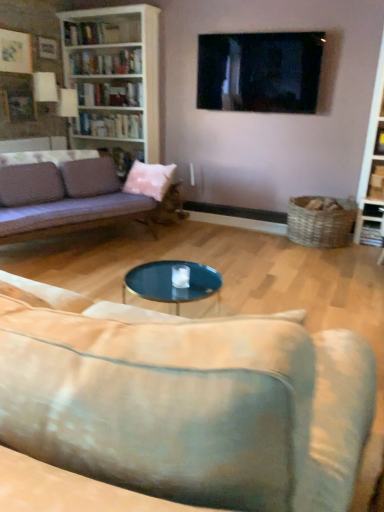
What do you see at coordinates (186, 400) in the screenshot?
I see `velvet beige couch at lower center, the 1th studio couch viewed from the front` at bounding box center [186, 400].

Locate an element on the screen. white glossy bookshelf at upper left, the 2th book positioned from the bottom is located at coordinates (106, 62).

I want to click on white glossy bookshelf at upper left, so click(x=102, y=31).

Describe the element at coordinates (111, 125) in the screenshot. The width and height of the screenshot is (384, 512). I see `hardcover books at upper left, the first book from the bottom` at that location.

The width and height of the screenshot is (384, 512). What are the coordinates of `white wood bookcase at upper left` in the screenshot? It's located at (114, 76).

Are white wood bookcase at upper left and white glossy bookshelf at upper left located far from each other?

They are positioned close to each other.

From the image's perspective, who appears lower, white wood bookcase at upper left or white glossy bookshelf at upper left?

white wood bookcase at upper left appears lower in the image.

Considering the relative sizes of white wood bookcase at upper left and white glossy bookshelf at upper left in the image provided, is white wood bookcase at upper left taller than white glossy bookshelf at upper left?

Indeed, white wood bookcase at upper left has a greater height compared to white glossy bookshelf at upper left.

Which object is wider, white wood bookcase at upper left or white glossy bookshelf at upper left?

Wider between the two is white wood bookcase at upper left.

Between white glossy bookshelf at upper left and hardcover books at upper left, the second book from the top, which one has smaller size?

With smaller size is white glossy bookshelf at upper left.

You are a GUI agent. You are given a task and a screenshot of the screen. Output one action in this format:
    pyautogui.click(x=<x>, y=<y>)
    Task: Click on the 2nd book counting from the left of the white glossy bookshelf at upper left
    The width and height of the screenshot is (384, 512).
    Given the screenshot: What is the action you would take?
    pyautogui.click(x=111, y=125)

From the image's perspective, would you say white glossy bookshelf at upper left is shown under hardcover books at upper left, the second book from the top?

No.

Which is closer to the camera, (108, 120) or (117, 71)?

Point (108, 120) is positioned farther from the camera compared to point (117, 71).

Which of these two, hardcover books at upper left, the second book from the top, or white glossy bookshelf at upper left, which is the first book in top-to-bottom order, is bigger?

hardcover books at upper left, the second book from the top, is bigger.

The height and width of the screenshot is (512, 384). I want to click on book beneath the white glossy bookshelf at upper left, the 2th book positioned from the bottom (from a real-world perspective), so [x=111, y=125].

Is the position of black glossy tv at upper center less distant than that of white wood bookcase at upper left?

Yes, it is in front of white wood bookcase at upper left.

Does black glossy tv at upper center have a lesser width compared to white wood bookcase at upper left?

Result: Yes.

Who is smaller, black glossy tv at upper center or white wood bookcase at upper left?

With smaller size is black glossy tv at upper center.

In the scene shown: Is black glossy tv at upper center aimed at white wood bookcase at upper left?

No.

How much distance is there between black glossy tv at upper center and pink fabric pillow at center?

black glossy tv at upper center and pink fabric pillow at center are 1.21 meters apart from each other.

Can you confirm if black glossy tv at upper center is positioned to the right of pink fabric pillow at center?

Indeed, black glossy tv at upper center is positioned on the right side of pink fabric pillow at center.

Is black glossy tv at upper center oriented towards pink fabric pillow at center?

No, black glossy tv at upper center does not turn towards pink fabric pillow at center.

Looking at this image, would you say pink fabric pillow at center is part of black glossy tv at upper center's contents?

Definitely not — pink fabric pillow at center is not inside black glossy tv at upper center.

How much distance is there between pink fabric pillow at center and velvet beige couch at lower center, acting as the 2th studio couch starting from the back?

They are 2.96 meters apart.

From the image's perspective, is pink fabric pillow at center below velvet beige couch at lower center, the 1th studio couch viewed from the front?

No.

Is pink fabric pillow at center directly adjacent to velvet beige couch at lower center, acting as the 2th studio couch starting from the back?

pink fabric pillow at center and velvet beige couch at lower center, acting as the 2th studio couch starting from the back, are not in contact.

Is pink fabric pillow at center thinner than velvet beige couch at lower center, acting as the 2th studio couch starting from the back?

Yes.

From the image's perspective, is pink fabric pillow at center located above or below velvet purple couch at left, the first studio couch viewed from the back?

From the image's perspective, pink fabric pillow at center appears above velvet purple couch at left, the first studio couch viewed from the back.

From a real-world perspective, is pink fabric pillow at center beneath velvet purple couch at left, the second studio couch positioned from the front?

No, from a real-world perspective, pink fabric pillow at center is not below velvet purple couch at left, the second studio couch positioned from the front.

Can you confirm if pink fabric pillow at center is positioned to the left of velvet purple couch at left, the second studio couch positioned from the front?

No.

Find the location of a particular element. bookcase that is below the white glossy bookshelf at upper left (from the image's perspective) is located at coordinates (114, 76).

Find the location of a particular element. The width and height of the screenshot is (384, 512). the 2nd book to the left when counting from the white glossy bookshelf at upper left is located at coordinates (111, 125).

Which object lies further to the anchor point white glossy bookshelf at upper left, white glossy bookshelf at upper left, the 2th book positioned from the bottom, or black glossy tv at upper center?

black glossy tv at upper center.

Which object lies nearer to the anchor point white glossy bookshelf at upper left, velvet beige couch at lower center, the 1th studio couch viewed from the front, or black glossy tv at upper center?

black glossy tv at upper center.

Considering their positions, is pink fabric pillow at center positioned closer to hardcover books at upper left, the first book from the bottom, than white glossy bookshelf at upper left?

white glossy bookshelf at upper left.

Considering their positions, is white glossy bookshelf at upper left, the 2th book positioned from the bottom, positioned further to white wood bookcase at upper left than velvet beige couch at lower center, acting as the 2th studio couch starting from the back?

velvet beige couch at lower center, acting as the 2th studio couch starting from the back, is further to white wood bookcase at upper left.

Based on the photo, based on their spatial positions, is pink fabric pillow at center or hardcover books at upper left, the first book from the bottom, closer to white glossy bookshelf at upper left?

hardcover books at upper left, the first book from the bottom, is positioned closer to the anchor white glossy bookshelf at upper left.

Based on their spatial positions, is pink fabric pillow at center or velvet beige couch at lower center, the 1th studio couch viewed from the front, further from white glossy bookshelf at upper left?

Among the two, velvet beige couch at lower center, the 1th studio couch viewed from the front, is located further to white glossy bookshelf at upper left.

Estimate the real-world distances between objects in this image. Which object is further from white glossy bookshelf at upper left, white wood bookcase at upper left or velvet beige couch at lower center, the 1th studio couch viewed from the front?

velvet beige couch at lower center, the 1th studio couch viewed from the front.

Looking at the image, which one is located closer to velvet beige couch at lower center, acting as the 2th studio couch starting from the back, white wood bookcase at upper left or black glossy tv at upper center?

black glossy tv at upper center is closer to velvet beige couch at lower center, acting as the 2th studio couch starting from the back.

The width and height of the screenshot is (384, 512). Identify the location of bookcase between velvet purple couch at left, the first studio couch viewed from the back, and black glossy tv at upper center. (114, 76).

I want to click on throw pillow between velvet beige couch at lower center, acting as the 2th studio couch starting from the back, and white glossy bookshelf at upper left, the 2th book positioned from the bottom, in the front-back direction, so click(149, 179).

What are the coordinates of `bookcase positioned between velvet purple couch at left, the first studio couch viewed from the back, and white glossy bookshelf at upper left, which is the first book in top-to-bottom order, from near to far` in the screenshot? It's located at (114, 76).

Locate an element on the screen. This screenshot has height=512, width=384. throw pillow between velvet beige couch at lower center, acting as the 2th studio couch starting from the back, and white glossy bookshelf at upper left, along the z-axis is located at coordinates (149, 179).